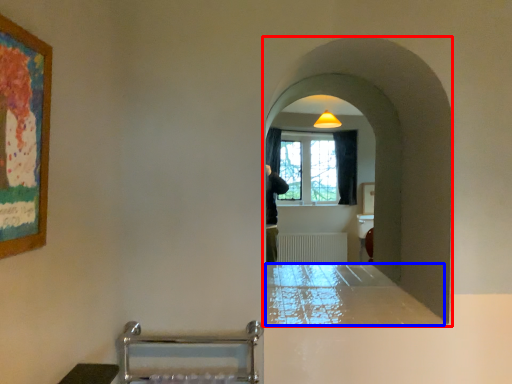
Question: Among these objects, which one is farthest to the camera, passage (highlighted by a red box) or counter top (highlighted by a blue box)?

Choices:
 (A) passage
 (B) counter top

Answer: (A)